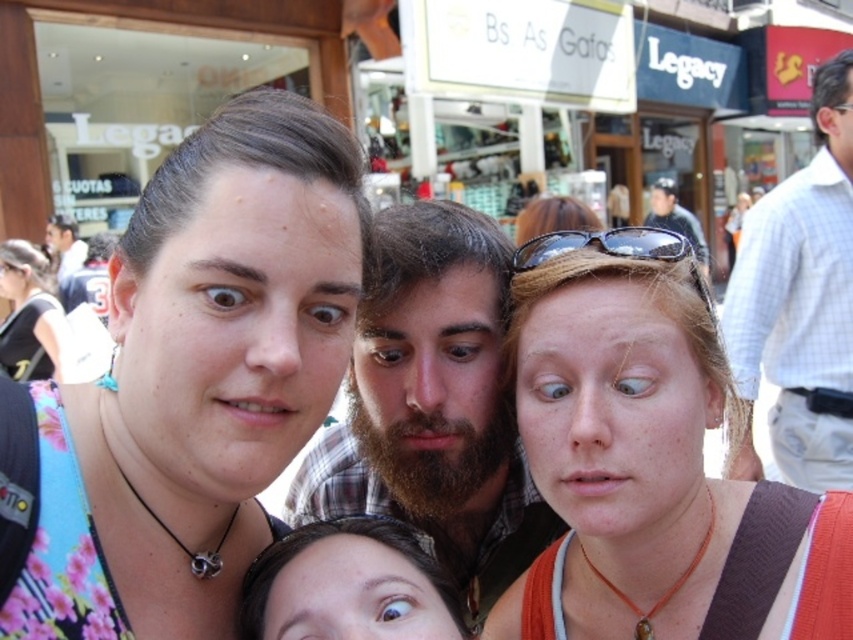
Question: Which object is closer to the camera taking this photo?

Choices:
 (A) black reflective sunglasses at upper center
 (B) matte orange necklace at center
 (C) bearded man at center
 (D) pink floral shirt at center

Answer: (D)

Question: Observing the image, what is the correct spatial positioning of pink floral shirt at center in reference to black plastic sunglasses at upper center?

Choices:
 (A) right
 (B) left

Answer: (B)

Question: Does matte orange necklace at center appear on the left side of bearded man at center?

Choices:
 (A) yes
 (B) no

Answer: (B)

Question: Based on their relative distances, which object is farther from the matte black cap at upper right?

Choices:
 (A) smooth brown hair at center
 (B) pink floral shirt at center
 (C) black plastic sunglasses at upper center
 (D) bearded man at center

Answer: (B)

Question: Does white checkered shirt at right have a greater width compared to black reflective sunglasses at upper center?

Choices:
 (A) yes
 (B) no

Answer: (A)

Question: Which point is closer to the camera taking this photo?

Choices:
 (A) (234, 579)
 (B) (73, 266)
 (C) (546, 596)

Answer: (A)